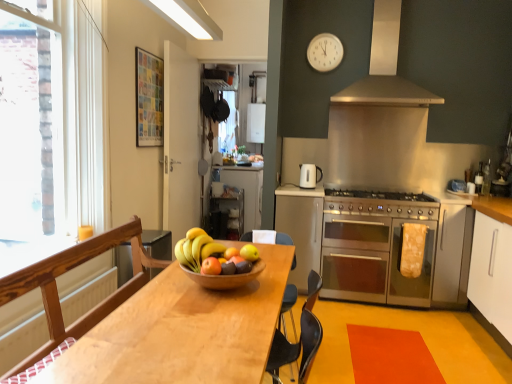
What do you see at coordinates (309, 175) in the screenshot? The image size is (512, 384). I see `white glossy electric kettle at upper center` at bounding box center [309, 175].

In order to face yellow matte bananas at center, should I rotate leftwards or rightwards?

Turn left by 7.245 degrees to look at yellow matte bananas at center.

Describe the element at coordinates (70, 269) in the screenshot. I see `wooden chair at left` at that location.

What do you see at coordinates (451, 255) in the screenshot? I see `satin silver oven at right, the 1th cabinetry in the right-to-left sequence` at bounding box center [451, 255].

Locate an element on the screen. wooden bowl of fruit at center is located at coordinates (216, 261).

Image resolution: width=512 pixels, height=384 pixels. Describe the element at coordinates (216, 261) in the screenshot. I see `wooden bowl of fruit at center` at that location.

This screenshot has height=384, width=512. I want to click on stainless steel gas stove at center, so click(382, 203).

The height and width of the screenshot is (384, 512). What do you see at coordinates (382, 203) in the screenshot? I see `stainless steel gas stove at center` at bounding box center [382, 203].

I want to click on white glossy electric kettle at upper center, so click(x=309, y=175).

Is white glossy electric kettle at upper center shorter than yellow matte bananas at center?

No.

Measure the distance from white glossy electric kettle at upper center to yellow matte bananas at center.

white glossy electric kettle at upper center and yellow matte bananas at center are 6.38 feet apart from each other.

Find the location of a particular element. The image size is (512, 384). banana in front of the white glossy electric kettle at upper center is located at coordinates (196, 249).

Does white glossy electric kettle at upper center have a lesser width compared to yellow matte bananas at center?

Indeed, white glossy electric kettle at upper center has a lesser width compared to yellow matte bananas at center.

Is matte orange apple at center, the first apple when ordered from front to back, aimed at white glossy cabinet at center, positioned as the 1th cabinetry in back-to-front order?

Yes, matte orange apple at center, the first apple when ordered from front to back, is turned towards white glossy cabinet at center, positioned as the 1th cabinetry in back-to-front order.

Based on their sizes in the image, would you say matte orange apple at center, which appears as the 2th apple when viewed from the right, is bigger or smaller than white glossy cabinet at center, which ranks as the third cabinetry in right-to-left order?

In the image, matte orange apple at center, which appears as the 2th apple when viewed from the right, appears to be smaller than white glossy cabinet at center, which ranks as the third cabinetry in right-to-left order.

From the image's perspective, is matte orange apple at center, the first apple when ordered from front to back, on top of white glossy cabinet at center, which ranks as the third cabinetry in right-to-left order?

No, from the image's perspective, matte orange apple at center, the first apple when ordered from front to back, is not above white glossy cabinet at center, which ranks as the third cabinetry in right-to-left order.

Is white glossy cabinet at center, marked as the third cabinetry in a front-to-back arrangement, located within matte orange apple at center, the 2th apple viewed from the back?

No.

Does yellow fabric oven mitt at right have a larger size compared to light brown wooden table at center?

Actually, yellow fabric oven mitt at right might be smaller than light brown wooden table at center.

Considering the sizes of yellow fabric oven mitt at right and light brown wooden table at center in the image, is yellow fabric oven mitt at right wider or thinner than light brown wooden table at center?

Clearly, yellow fabric oven mitt at right has less width compared to light brown wooden table at center.

Between point (413, 233) and point (227, 312), which one is positioned behind?

Point (413, 233)

Who is taller, white plastic clock at upper center or matte orange apple at center, the 1th apple in the left-to-right sequence?

With more height is white plastic clock at upper center.

Which of these two, white plastic clock at upper center or matte orange apple at center, the 1th apple in the left-to-right sequence, is smaller?

With smaller size is matte orange apple at center, the 1th apple in the left-to-right sequence.

Looking at this image, could you tell me if white plastic clock at upper center is turned towards matte orange apple at center, the 1th apple in the left-to-right sequence?

No, white plastic clock at upper center is not oriented towards matte orange apple at center, the 1th apple in the left-to-right sequence.

Looking at this image, is white plastic clock at upper center spatially inside matte orange apple at center, the 1th apple in the left-to-right sequence, or outside of it?

white plastic clock at upper center is not inside matte orange apple at center, the 1th apple in the left-to-right sequence, it's outside.

Do you think orange matte at center is within stainless steel oven at center right, or outside of it?

orange matte at center is not inside stainless steel oven at center right, it's outside.

Does orange matte at center have a greater height compared to stainless steel oven at center right?

Incorrect, the height of orange matte at center is not larger of that of stainless steel oven at center right.

Is orange matte at center wider or thinner than stainless steel oven at center right?

Considering their sizes, orange matte at center looks slimmer than stainless steel oven at center right.

Which object is further away from the camera, orange matte at center or stainless steel oven at center right?

stainless steel oven at center right is further away from the camera.

Is white glossy cabinet at center, positioned as the 2th cabinetry in left-to-right order, in contact with wooden chair at left?

No, white glossy cabinet at center, positioned as the 2th cabinetry in left-to-right order, is not next to wooden chair at left.

Does point (303, 203) come in front of point (55, 271)?

No, it is behind (55, 271).

Is white glossy cabinet at center, arranged as the second cabinetry when viewed from the front, oriented towards wooden chair at left?

Yes.

Is white glossy cabinet at center, the second cabinetry viewed from the right, smaller than wooden chair at left?

Correct, white glossy cabinet at center, the second cabinetry viewed from the right, occupies less space than wooden chair at left.

Between stainless steel gas stove at center and matte orange apple at center, the 2th apple viewed from the back, which one has less height?

Standing shorter between the two is matte orange apple at center, the 2th apple viewed from the back.

Considering the relative positions of stainless steel gas stove at center and matte orange apple at center, the 2th apple viewed from the back, in the image provided, is stainless steel gas stove at center to the right of matte orange apple at center, the 2th apple viewed from the back, from the viewer's perspective?

Yes.

Are stainless steel gas stove at center and matte orange apple at center, the 1th apple in the left-to-right sequence, far apart?

stainless steel gas stove at center is positioned a significant distance from matte orange apple at center, the 1th apple in the left-to-right sequence.

Starting from the stainless steel gas stove at center, which apple is the 2nd one to the left? Please provide its 2D coordinates.

[(211, 266)]

Where is `banana lying in front of the white glossy electric kettle at upper center`? The image size is (512, 384). banana lying in front of the white glossy electric kettle at upper center is located at coordinates (196, 249).

From a real-world perspective, starting from the white glossy cabinet at center, which appears as the first cabinetry when viewed from the left, which apple is the 2nd one vertically above it? Please provide its 2D coordinates.

[(211, 266)]

Estimate the real-world distances between objects in this image. Which object is closer to stainless steel oven at center right, white glossy cabinet at center, which appears as the first cabinetry when viewed from the left, or white glossy cabinet at center, the second cabinetry viewed from the right?

Based on the image, white glossy cabinet at center, the second cabinetry viewed from the right, appears to be nearer to stainless steel oven at center right.

From the image, which object appears to be nearer to white glossy cabinet at center, which ranks as the 2th cabinetry in back-to-front order, matte orange apple at center, the 1th apple in the left-to-right sequence, or white glossy electric kettle at upper center?

Based on the image, white glossy electric kettle at upper center appears to be nearer to white glossy cabinet at center, which ranks as the 2th cabinetry in back-to-front order.

Estimate the real-world distances between objects in this image. Which object is further from white plastic clock at upper center, transparent glass window at left or wooden chair at left?

The object further to white plastic clock at upper center is wooden chair at left.

When comparing their distances from satin silver exhaust hood at upper center, does yellow matte bananas at center or white glossy electric kettle at upper center seem closer?

Based on the image, white glossy electric kettle at upper center appears to be nearer to satin silver exhaust hood at upper center.

Estimate the real-world distances between objects in this image. Which object is further from yellow fabric oven mitt at right, light brown wooden table at center or satin silver oven at right, placed as the 1th cabinetry when sorted from front to back?

light brown wooden table at center lies further to yellow fabric oven mitt at right than the other object.

Which object lies further to the anchor point yellow fabric oven mitt at right, wooden chair at left or metallic silver microwave at center, positioned as the second appliance in right-to-left order?

wooden chair at left is positioned further to the anchor yellow fabric oven mitt at right.

Looking at the image, which one is located closer to satin silver exhaust hood at upper center, matte yellow apple at center, which appears as the first apple when viewed from the right, or yellow matte bananas at center?

Based on the image, matte yellow apple at center, which appears as the first apple when viewed from the right, appears to be nearer to satin silver exhaust hood at upper center.

Considering their positions, is stainless steel oven at center right positioned closer to matte yellow apple at center, which is the 1th apple in back-to-front order, than transparent glass window at left?

transparent glass window at left lies closer to matte yellow apple at center, which is the 1th apple in back-to-front order, than the other object.

The image size is (512, 384). I want to click on material situated between transparent glass window at left and satin silver oven at right, the 3th cabinetry positioned from the left, from left to right, so click(x=412, y=249).

You are a GUI agent. You are given a task and a screenshot of the screen. Output one action in this format:
    pyautogui.click(x=<x>, y=<y>)
    Task: Click on the material located between orange matte at center and white plastic clock at upper center in the depth direction
    Image resolution: width=512 pixels, height=384 pixels.
    Given the screenshot: What is the action you would take?
    pyautogui.click(x=412, y=249)

Find the location of a particular element. Image resolution: width=512 pixels, height=384 pixels. oven between yellow matte bananas at center and white glossy cabinet at center, which ranks as the 2th cabinetry in back-to-front order, in the front-back direction is located at coordinates (373, 261).

Locate an element on the screen. The height and width of the screenshot is (384, 512). orange positioned between yellow matte bananas at center and yellow fabric oven mitt at right from near to far is located at coordinates (231, 253).